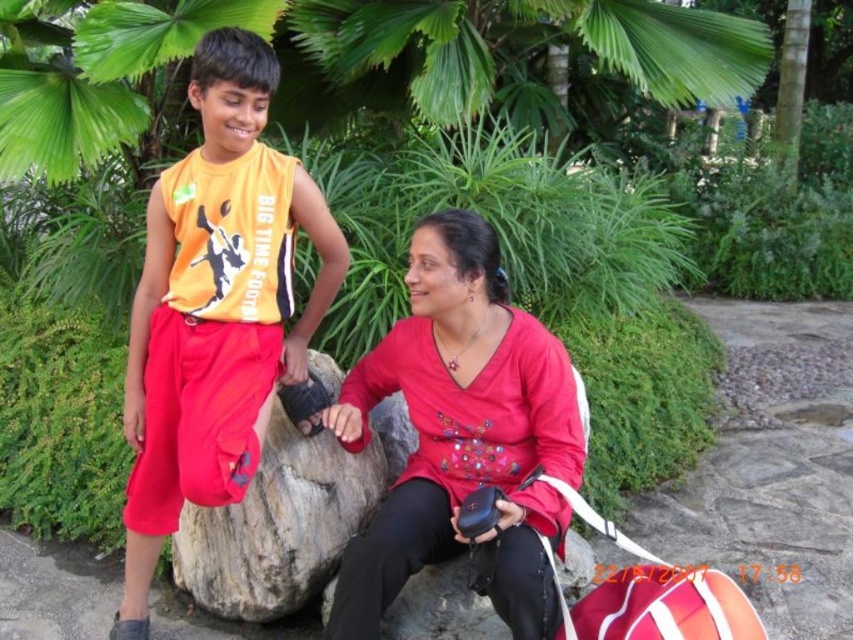
Question: Does orange jersey at upper left appear over rough textured rock at center?

Choices:
 (A) no
 (B) yes

Answer: (B)

Question: Considering the relative positions of orange jersey at upper left and matte red blouse at center in the image provided, where is orange jersey at upper left located with respect to matte red blouse at center?

Choices:
 (A) right
 (B) left

Answer: (B)

Question: Can you confirm if matte red blouse at center is positioned to the right of rough textured rock at center?

Choices:
 (A) yes
 (B) no

Answer: (A)

Question: Which object is positioned farthest from the orange jersey at upper left?

Choices:
 (A) matte red blouse at center
 (B) rough textured rock at center

Answer: (A)

Question: Which point is farther from the camera taking this photo?

Choices:
 (A) (514, 323)
 (B) (157, 273)

Answer: (B)

Question: Which point is farther to the camera?

Choices:
 (A) (207, 392)
 (B) (538, 580)

Answer: (A)